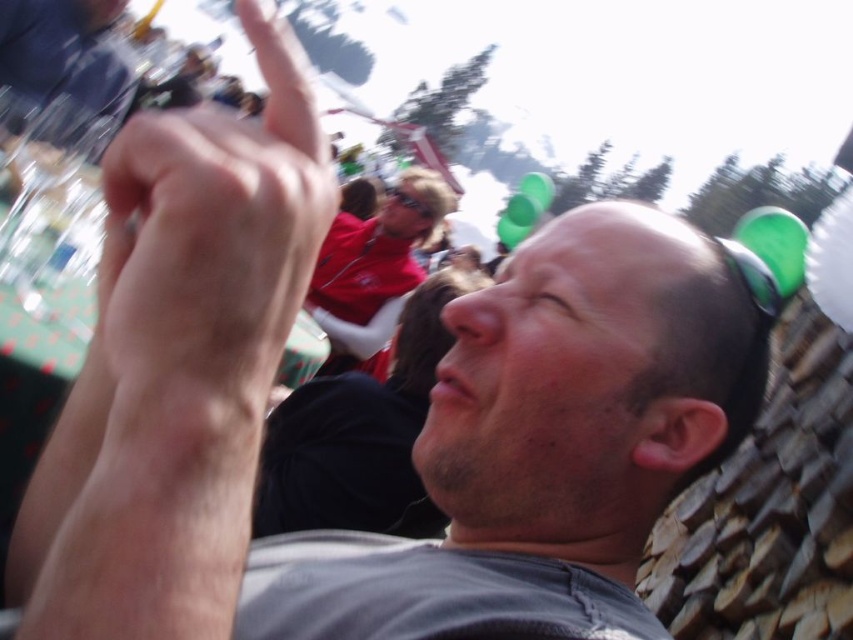
Does skinny flesh at upper left appear over matte red shirt at center?

Yes.

Can you confirm if skinny flesh at upper left is positioned to the left of matte red shirt at center?

Indeed, skinny flesh at upper left is positioned on the left side of matte red shirt at center.

This screenshot has width=853, height=640. Describe the element at coordinates (264, 108) in the screenshot. I see `skinny flesh at upper left` at that location.

What are the coordinates of `skinny flesh at upper left` in the screenshot? It's located at (264, 108).